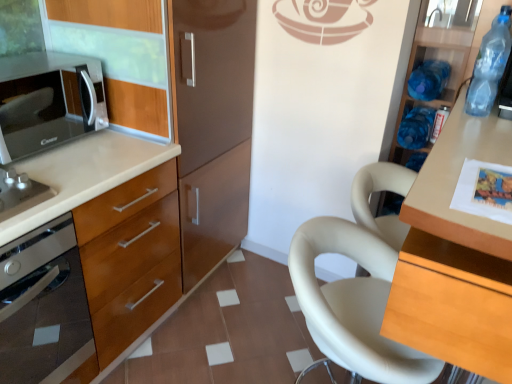
Where is `vacant region to the right of black glossy microwave at left`? Image resolution: width=512 pixels, height=384 pixels. vacant region to the right of black glossy microwave at left is located at coordinates (113, 156).